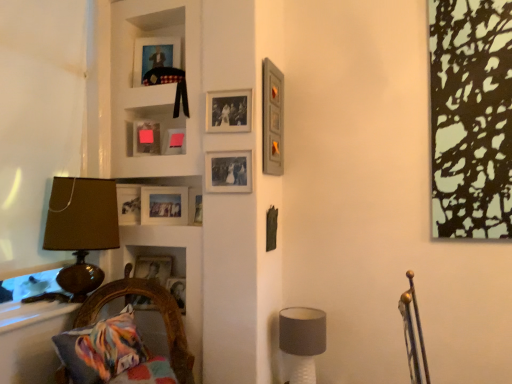
Question: From the image's perspective, is matte silver picture frame at upper center, which is counted as the 3th picture frame, starting from the bottom, located above or below wooden picture frame at lower left, which is the first picture frame in bottom-to-top order?

Choices:
 (A) above
 (B) below

Answer: (A)

Question: From a real-world perspective, relative to wooden picture frame at lower left, which is the first picture frame in bottom-to-top order, is matte silver picture frame at upper center, which is counted as the 3th picture frame, starting from the bottom, vertically above or below?

Choices:
 (A) above
 (B) below

Answer: (A)

Question: Which is farther from the pink matte picture frame at upper center, the 4th picture frame positioned from the bottom?

Choices:
 (A) matte glass picture frame at center, placed as the seventh picture frame when sorted from top to bottom
 (B) wooden picture frame at lower left, which is the first picture frame in bottom-to-top order
 (C) matte gray lampshade at lower right, which appears as the second table lamp when viewed from the top
 (D) multicolored fabric cushion at lower left
 (E) matte wooden picture frame at upper center, the 1th picture frame viewed from the top

Answer: (C)

Question: Considering the real-world distances, which object is closest to the multicolored fabric cushion at lower left?

Choices:
 (A) matte gray picture frame at upper right, the sixth picture frame from the bottom
 (B) matte glass picture frame at upper center, the seventh picture frame positioned from the bottom
 (C) brown fabric lampshade at left, the first table lamp viewed from the left
 (D) white glossy window sill at lower left
 (E) matte gray lampshade at lower right, which appears as the first table lamp when ordered from the bottom

Answer: (D)